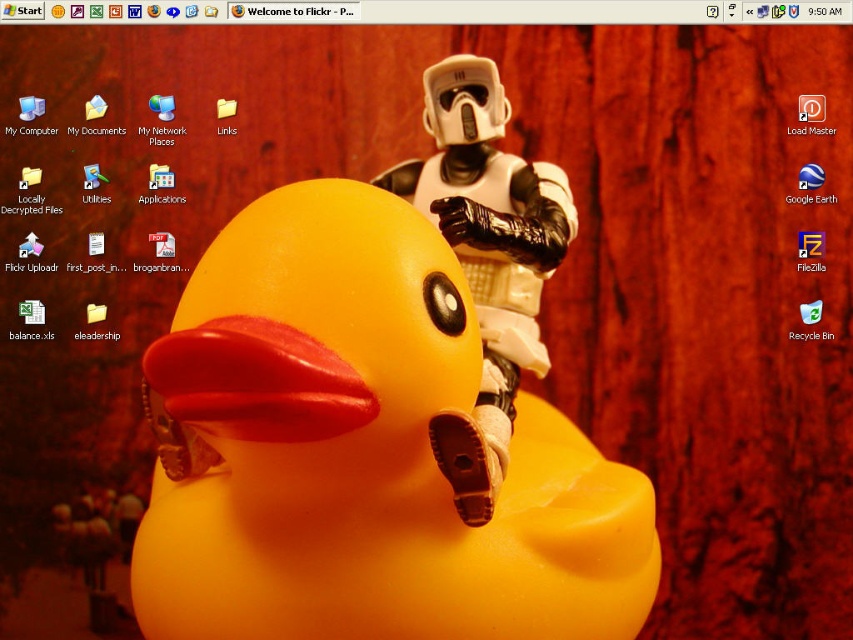
Question: Is rubber yellow duck at center below white matte stormtrooper helmet at center?

Choices:
 (A) no
 (B) yes

Answer: (B)

Question: Which of the following is the closest to the observer?

Choices:
 (A) tap(178, 371)
 (B) tap(432, 134)

Answer: (A)

Question: Where is rubber yellow duck at center located in relation to white matte stormtrooper helmet at center in the image?

Choices:
 (A) left
 (B) right

Answer: (A)

Question: Which point is closer to the camera?

Choices:
 (A) white matte stormtrooper helmet at center
 (B) rubber yellow duck at center

Answer: (B)

Question: Which of the following is the closest to the observer?

Choices:
 (A) white matte stormtrooper helmet at center
 (B) rubber yellow duck at center

Answer: (B)

Question: Can you confirm if rubber yellow duck at center is wider than white matte stormtrooper helmet at center?

Choices:
 (A) no
 (B) yes

Answer: (B)